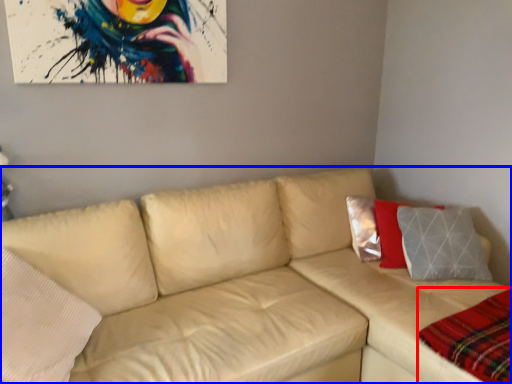
Question: Which of the following is the closest to the observer, plaid (highlighted by a red box) or studio couch (highlighted by a blue box)?

Choices:
 (A) plaid
 (B) studio couch

Answer: (B)